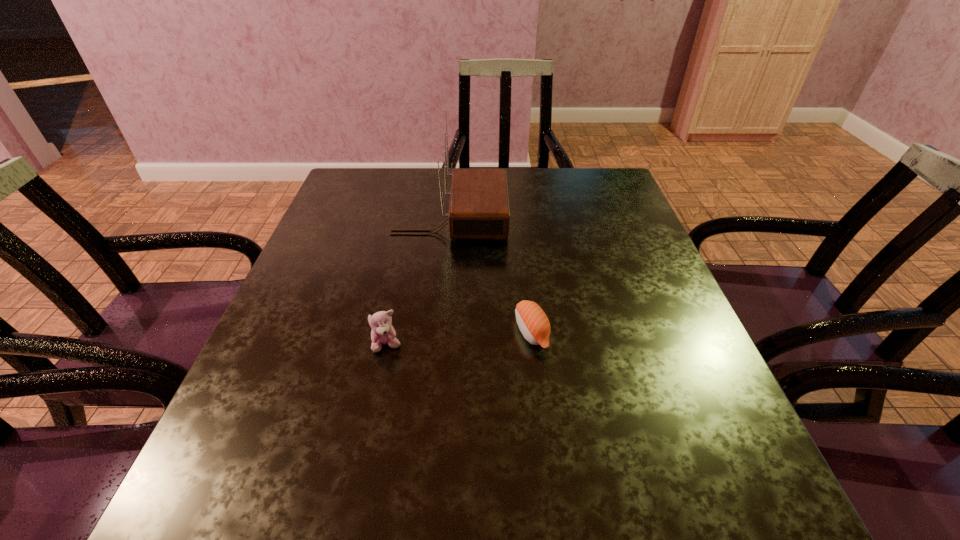
What are the coordinates of `radio_receiver` in the screenshot? It's located at 478,206.

Locate an element on the screen. Image resolution: width=960 pixels, height=540 pixels. the farthest object is located at coordinates [x=478, y=206].

At what (x,y) coordinates should I click in order to perform the action: click on the second shortest object. Please return your answer as a coordinate pair (x, y). This screenshot has width=960, height=540. Looking at the image, I should click on (382, 332).

The width and height of the screenshot is (960, 540). In order to click on sushi in this screenshot , I will do `click(532, 321)`.

Find the location of a particular element. The height and width of the screenshot is (540, 960). vacant position located 0.110m on the front panel of the tallest object is located at coordinates (549, 218).

This screenshot has height=540, width=960. Identify the location of vacant space located 0.180m at the face of the teddy bear. (366, 449).

This screenshot has height=540, width=960. In order to click on free location located on the left of the sushi in this screenshot , I will do `click(359, 332)`.

Locate an element on the screen. Image resolution: width=960 pixels, height=540 pixels. object at the far edge is located at coordinates (478, 206).

You are a GUI agent. You are given a task and a screenshot of the screen. Output one action in this format:
    pyautogui.click(x=<x>, y=<y>)
    Task: Click on the vacant space at the far edge
    
    Given the screenshot: What is the action you would take?
    pyautogui.click(x=404, y=175)

In the image, there is a desktop. Where is `vacant space at the near edge`? vacant space at the near edge is located at coordinates (313, 503).